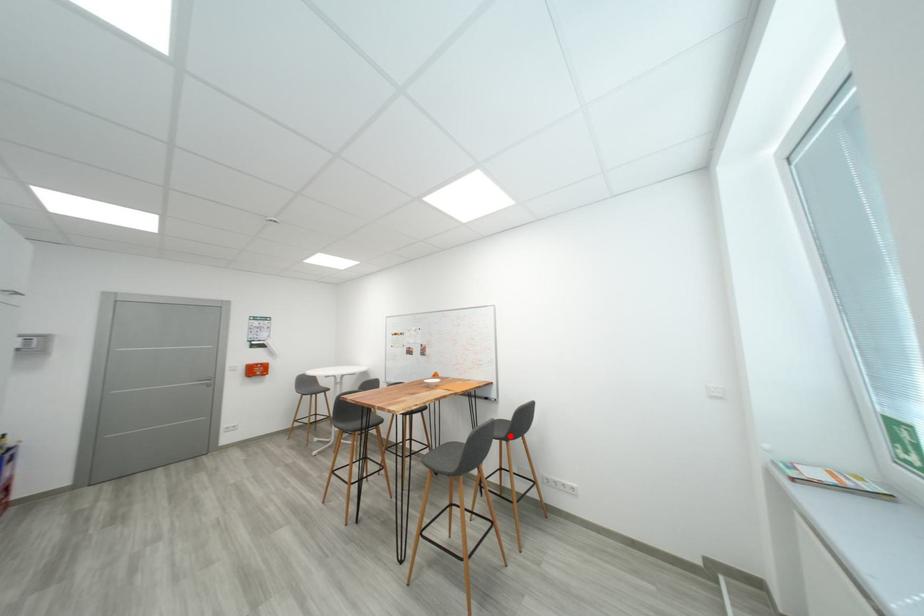
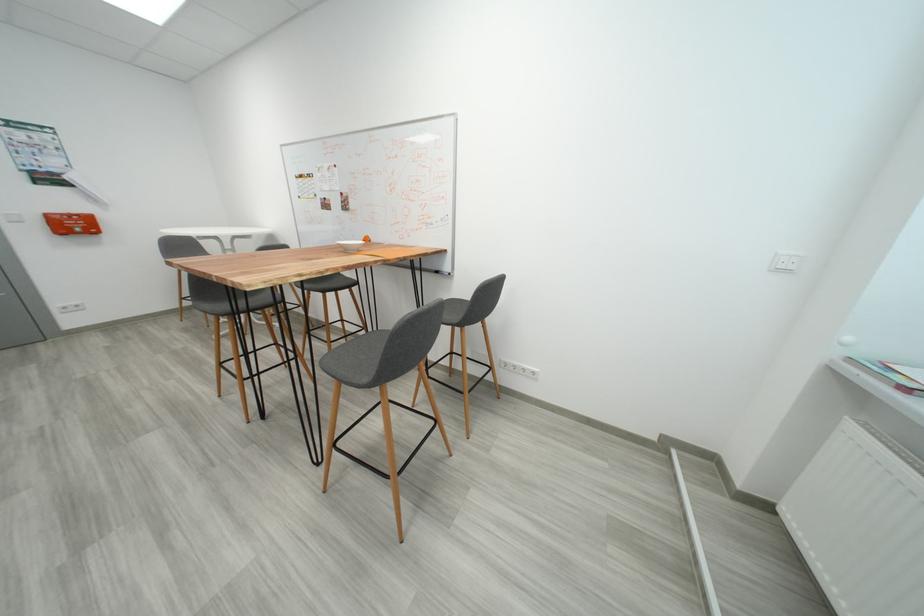
Question: I am providing you with two images of the same scene from different viewpoints. Image1 has a red point marked. In image2, the corresponding 3D location appears at what relative position? Reply with the corresponding letter.

Choices:
 (A) Closer
 (B) Farther

Answer: (A)